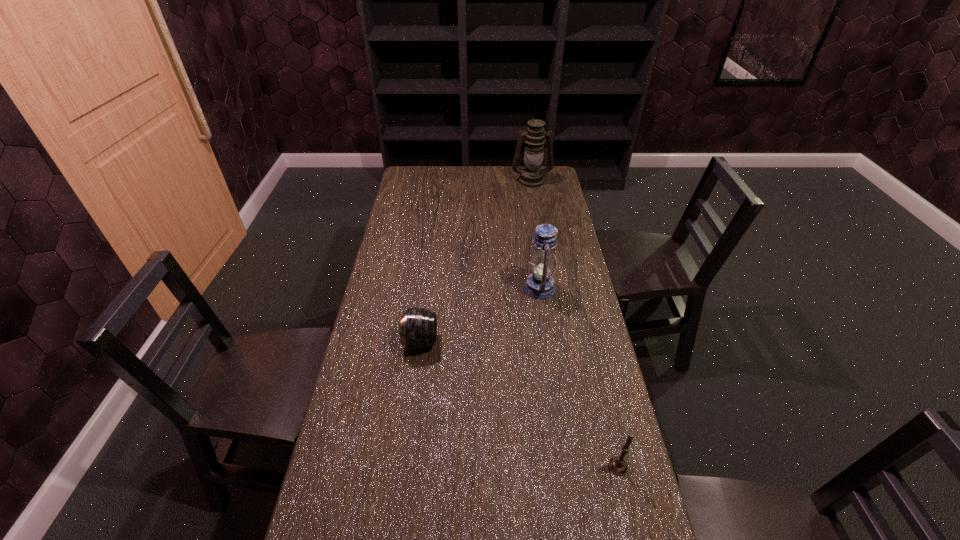
Locate an element on the screen. The image size is (960, 540). vacant space situated 0.100m on the back of the second shortest object is located at coordinates tap(608, 421).

Locate an element on the screen. The height and width of the screenshot is (540, 960). free space located at the front element of the leftmost object is located at coordinates (468, 342).

At what (x,y) coordinates should I click in order to perform the action: click on object positioned at the far edge. Please return your answer as a coordinate pair (x, y). Looking at the image, I should click on (531, 176).

At what (x,y) coordinates should I click in order to perform the action: click on object at the left edge. Please return your answer as a coordinate pair (x, y). Looking at the image, I should click on (418, 328).

Locate an element on the screen. This screenshot has height=540, width=960. oil lamp that is positioned at the right edge is located at coordinates (531, 176).

This screenshot has width=960, height=540. Identify the location of lantern that is at the right edge. (539, 284).

The width and height of the screenshot is (960, 540). In order to click on candle at the right edge in this screenshot , I will do `click(617, 465)`.

Locate an element on the screen. object located in the far right corner section of the desktop is located at coordinates (531, 176).

The height and width of the screenshot is (540, 960). I want to click on free region at the far edge of the desktop, so click(489, 188).

The height and width of the screenshot is (540, 960). Identify the location of free space at the left edge of the desktop. (401, 275).